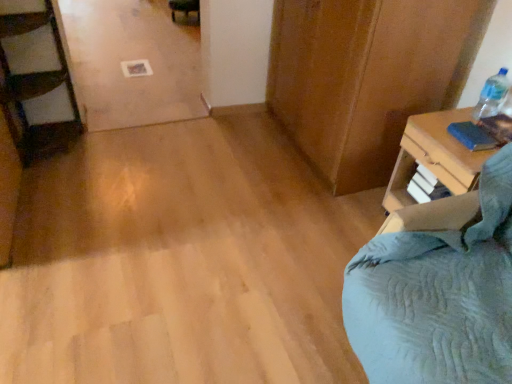
The image size is (512, 384). Find the location of `vacant area situated to the left side of clear plastic bottle at upper right`. vacant area situated to the left side of clear plastic bottle at upper right is located at coordinates (445, 116).